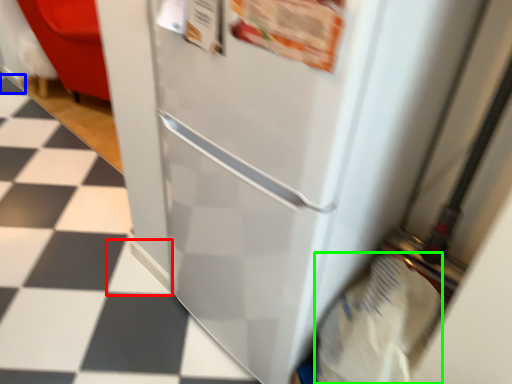
Question: Which is nearer to the tile (highlighted by a red box)? tile (highlighted by a blue box) or grocery bag (highlighted by a green box).

Choices:
 (A) tile
 (B) grocery bag

Answer: (B)